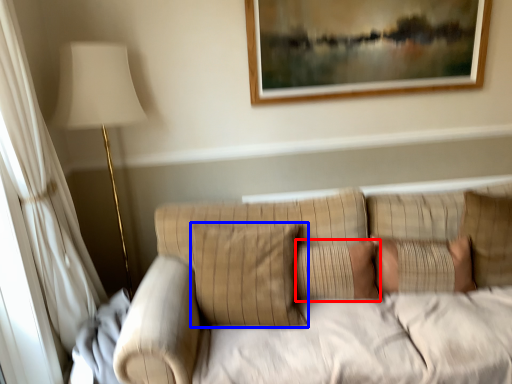
Question: Which point is closer to the camera, pillow (highlighted by a red box) or pillow (highlighted by a blue box)?

Choices:
 (A) pillow
 (B) pillow

Answer: (B)